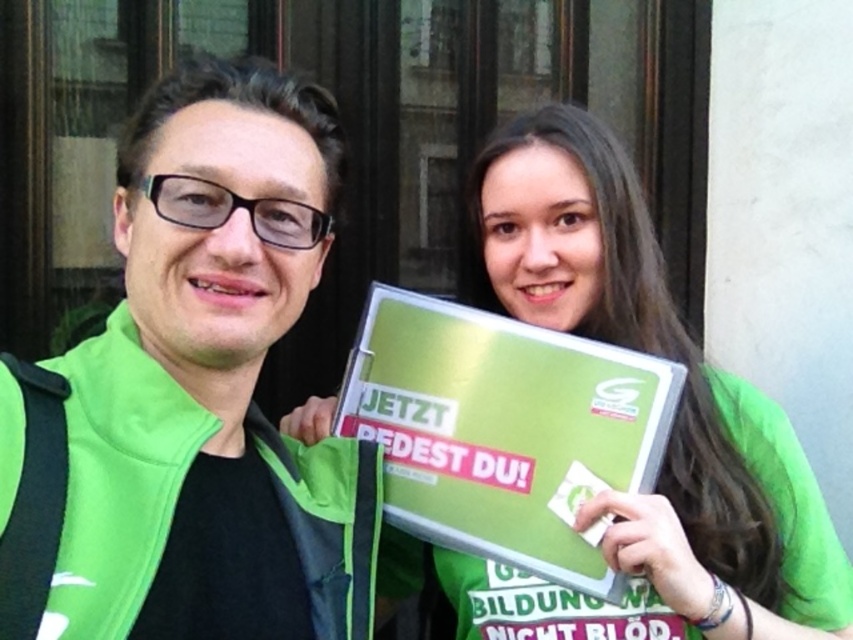
From the picture: Between green fabric jacket at left and green matte sign at center, which one appears on the right side from the viewer's perspective?

green matte sign at center

What do you see at coordinates (210, 385) in the screenshot?
I see `green fabric jacket at left` at bounding box center [210, 385].

Who is more distant from viewer, (195,572) or (532,196)?

The point (532,196) is more distant.

Identify the location of green fabric jacket at left. This screenshot has width=853, height=640. (210, 385).